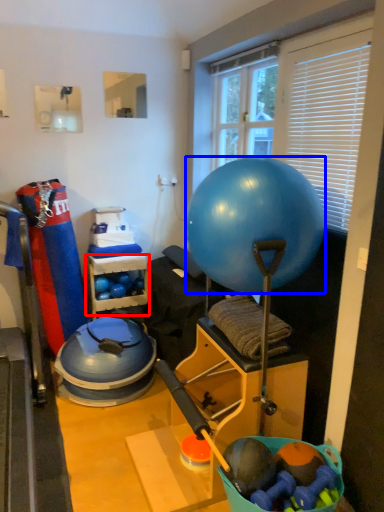
Question: Which of the following is the farthest to the observer, shelf (highlighted by a red box) or ball (highlighted by a blue box)?

Choices:
 (A) shelf
 (B) ball

Answer: (A)